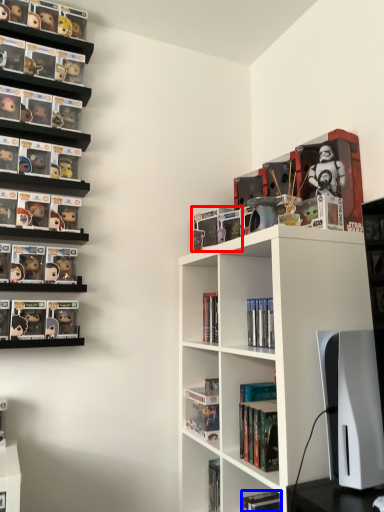
Question: Which object is closer to the camera taking this photo, book (highlighted by a red box) or book (highlighted by a blue box)?

Choices:
 (A) book
 (B) book

Answer: (B)